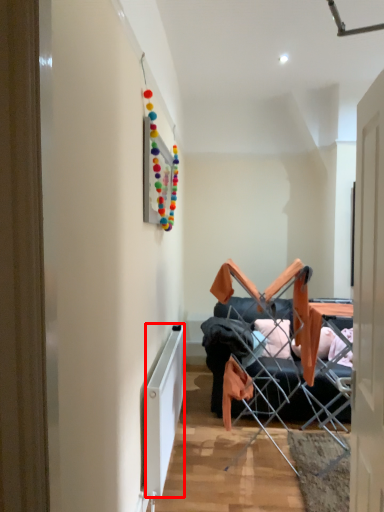
Question: In this image, where is radiator (annotated by the red box) located relative to chair?

Choices:
 (A) right
 (B) left

Answer: (B)